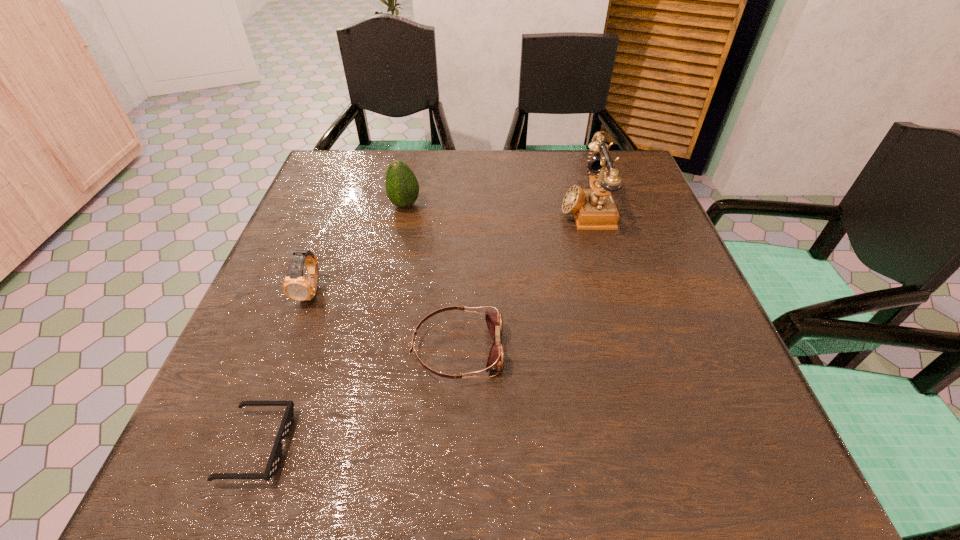
Identify the location of watch located at the left edge. Image resolution: width=960 pixels, height=540 pixels. (295, 286).

Where is `sunglasses that is positioned at the left edge`? sunglasses that is positioned at the left edge is located at coordinates (275, 458).

This screenshot has height=540, width=960. In order to click on object present at the right edge in this screenshot , I will do `click(594, 209)`.

Identify the location of object that is positioned at the near left corner. (275, 458).

At what (x,y) coordinates should I click in order to perform the action: click on object positioned at the far right corner. Please return your answer as a coordinate pair (x, y). The image size is (960, 540). Looking at the image, I should click on (594, 209).

Where is `free location at the far edge of the desktop`? Image resolution: width=960 pixels, height=540 pixels. free location at the far edge of the desktop is located at coordinates (471, 154).

Image resolution: width=960 pixels, height=540 pixels. Find the location of `vacant space at the near edge of the desktop`. vacant space at the near edge of the desktop is located at coordinates (535, 495).

In the image, there is a desktop. Find the location of `free space at the left edge`. free space at the left edge is located at coordinates (270, 301).

Locate an element on the screen. This screenshot has width=960, height=540. free space at the right edge of the desktop is located at coordinates (641, 280).

In the image, there is a desktop. At what (x,y) coordinates should I click in order to perform the action: click on vacant space at the far left corner. Please return your answer as a coordinate pair (x, y). The image size is (960, 540). Looking at the image, I should click on (352, 158).